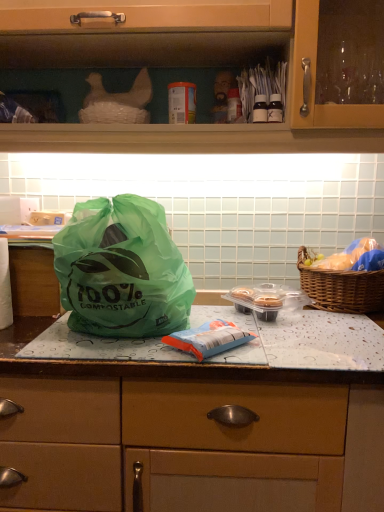
Question: From the image's perspective, is blue matte plastic bag at center, the 1th food positioned from the bottom, located beneath green plastic bag at center?

Choices:
 (A) no
 (B) yes

Answer: (A)

Question: Is the position of blue matte plastic bag at center, acting as the second food starting from the back, less distant than that of green plastic bag at center?

Choices:
 (A) yes
 (B) no

Answer: (A)

Question: Does blue matte plastic bag at center, which ranks as the 1th food in left-to-right order, have a lesser width compared to green plastic bag at center?

Choices:
 (A) no
 (B) yes

Answer: (B)

Question: From a real-world perspective, is blue matte plastic bag at center, which ranks as the 1th food in left-to-right order, physically below green plastic bag at center?

Choices:
 (A) yes
 (B) no

Answer: (B)

Question: Does blue matte plastic bag at center, which ranks as the 1th food in left-to-right order, appear on the left side of green plastic bag at center?

Choices:
 (A) no
 (B) yes

Answer: (A)

Question: From the image's perspective, is matte wood cabinet at upper center positioned above or below green plastic bag at center?

Choices:
 (A) below
 (B) above

Answer: (B)

Question: In terms of width, does matte wood cabinet at upper center look wider or thinner when compared to green plastic bag at center?

Choices:
 (A) wide
 (B) thin

Answer: (A)

Question: From their relative heights in the image, would you say matte wood cabinet at upper center is taller or shorter than green plastic bag at center?

Choices:
 (A) tall
 (B) short

Answer: (A)

Question: In the image, is matte wood cabinet at upper center positioned in front of or behind green plastic bag at center?

Choices:
 (A) behind
 (B) front

Answer: (A)

Question: Is point (94, 53) positioned closer to the camera than point (220, 350)?

Choices:
 (A) closer
 (B) farther

Answer: (B)

Question: Relative to blue matte plastic bag at center, which is counted as the 1th food, starting from the front, is matte wood cabinet at upper center in front or behind?

Choices:
 (A) behind
 (B) front

Answer: (A)

Question: Would you say matte wood cabinet at upper center is to the left or to the right of blue matte plastic bag at center, which is counted as the 1th food, starting from the front, in the picture?

Choices:
 (A) right
 (B) left

Answer: (B)

Question: Is matte wood cabinet at upper center situated inside blue matte plastic bag at center, which ranks as the 1th food in left-to-right order, or outside?

Choices:
 (A) inside
 (B) outside

Answer: (B)

Question: Do you think blue matte plastic bag at center, acting as the second food starting from the back, is within translucent plastic bag at right, the 1th food viewed from the top, or outside of it?

Choices:
 (A) outside
 (B) inside

Answer: (A)

Question: Considering their positions, is blue matte plastic bag at center, acting as the second food starting from the back, located in front of or behind translucent plastic bag at right, acting as the second food starting from the bottom?

Choices:
 (A) front
 (B) behind

Answer: (A)